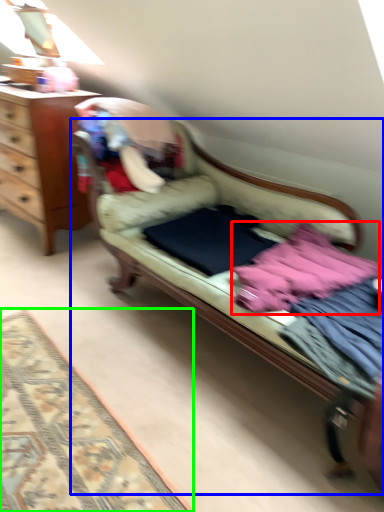
Question: Estimate the real-world distances between objects in this image. Which object is closer to baby clothe (highlighted by a red box), studio couch (highlighted by a blue box) or mat (highlighted by a green box)?

Choices:
 (A) studio couch
 (B) mat

Answer: (A)